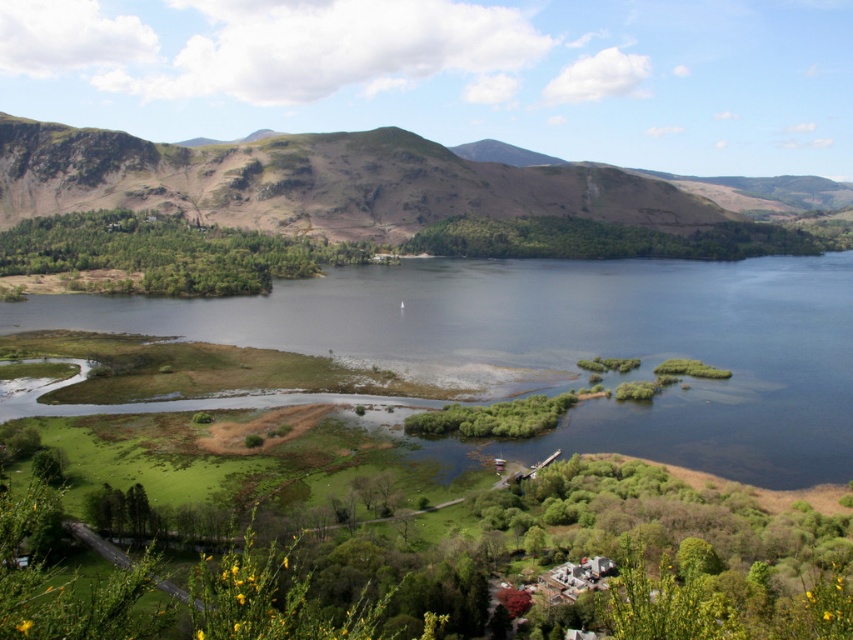
Question: Where is clear blue water at lower left located in relation to rugged brown mountain at center in the image?

Choices:
 (A) below
 (B) above

Answer: (A)

Question: Is clear blue water at lower left below rugged brown mountain at center?

Choices:
 (A) yes
 (B) no

Answer: (A)

Question: Among these objects, which one is nearest to the camera?

Choices:
 (A) rugged brown mountain at center
 (B) clear blue water at lower left

Answer: (B)

Question: Is clear blue water at lower left below rugged brown mountain at center?

Choices:
 (A) yes
 (B) no

Answer: (A)